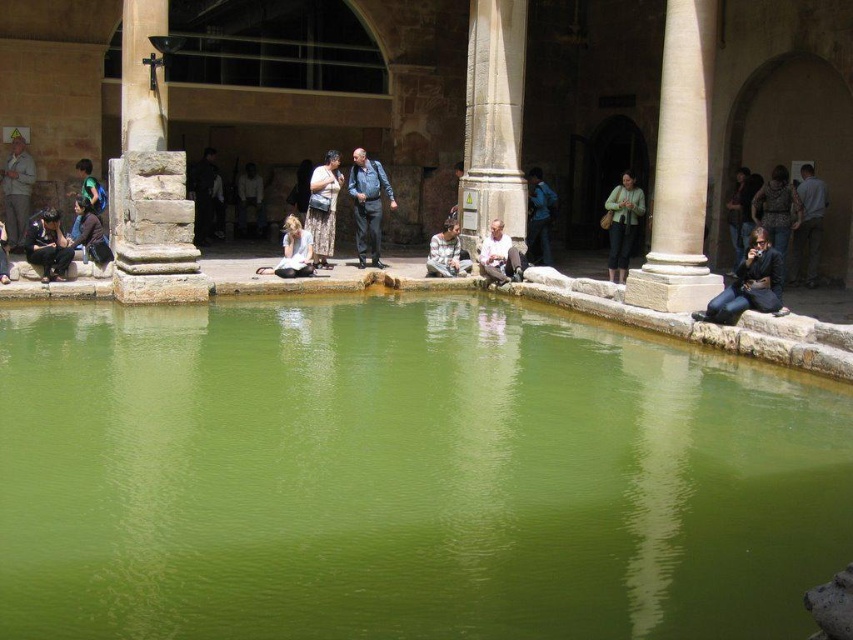
Is point (682, 266) positioned before point (323, 170)?

Yes, point (682, 266) is in front of point (323, 170).

Which of these two, white stone column at right or patterned fabric dress at center, stands taller?

With more height is white stone column at right.

Does point (653, 196) lie in front of point (309, 180)?

Yes.

Identify the location of white stone column at right. This screenshot has width=853, height=640. (680, 168).

Is blue denim jeans at center to the right of white stone man at center from the viewer's perspective?

Correct, you'll find blue denim jeans at center to the right of white stone man at center.

What do you see at coordinates (538, 218) in the screenshot? Image resolution: width=853 pixels, height=640 pixels. I see `blue denim jeans at center` at bounding box center [538, 218].

Locate an element on the screen. blue denim jeans at center is located at coordinates (538, 218).

Find the location of a particular element. blue denim jeans at center is located at coordinates (538, 218).

Is point (202, 291) more distant than point (497, 269)?

No, it is not.

Is stone column at left below white stone man at center?

Actually, stone column at left is above white stone man at center.

The height and width of the screenshot is (640, 853). What do you see at coordinates (149, 177) in the screenshot?
I see `stone column at left` at bounding box center [149, 177].

Image resolution: width=853 pixels, height=640 pixels. Find the location of `stone column at left`. stone column at left is located at coordinates (149, 177).